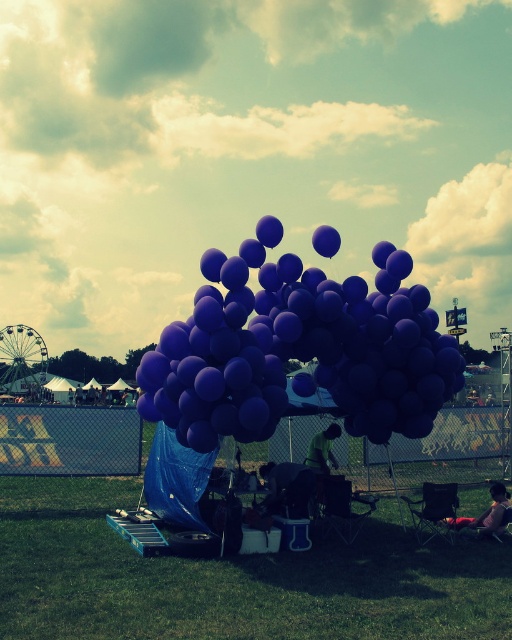
Can you confirm if green grass at lower center is positioned to the left of matte pink shirt at lower right?

Correct, you'll find green grass at lower center to the left of matte pink shirt at lower right.

Where is `green grass at lower center`? green grass at lower center is located at coordinates (233, 579).

Can you confirm if matte pink shirt at lower right is thinner than green fabric at center?

No, matte pink shirt at lower right is not thinner than green fabric at center.

What do you see at coordinates (486, 513) in the screenshot? I see `matte pink shirt at lower right` at bounding box center [486, 513].

Who is more distant from viewer, (483,515) or (317,464)?

The point (317,464) is more distant.

Where is `matte pink shirt at lower right`? The height and width of the screenshot is (640, 512). matte pink shirt at lower right is located at coordinates (486, 513).

Describe the element at coordinates (233, 579) in the screenshot. I see `green grass at lower center` at that location.

Who is higher up, green grass at lower center or matte purple balloons at center?

matte purple balloons at center is higher up.

Does point (137, 593) come behind point (195, 406)?

No, it is in front of (195, 406).

Identify the location of green grass at lower center. Image resolution: width=512 pixels, height=640 pixels. (233, 579).